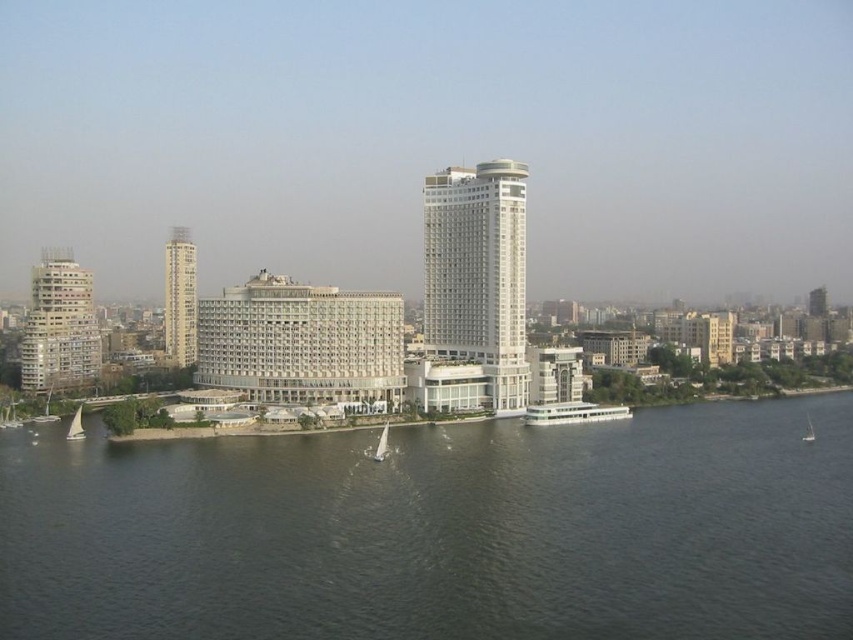
Does smooth beige tower at left have a greater height compared to white sailboat at lower center?

Indeed, smooth beige tower at left has a greater height compared to white sailboat at lower center.

Is point (189, 234) closer to viewer compared to point (381, 449)?

No.

Image resolution: width=853 pixels, height=640 pixels. What are the coordinates of `smooth beige tower at left` in the screenshot? It's located at (180, 298).

Does dark gray water at center appear over white glossy building at center?

Incorrect, dark gray water at center is not positioned above white glossy building at center.

Does dark gray water at center lie in front of white glossy building at center?

Yes, it is.

Find the location of a particular element. dark gray water at center is located at coordinates (440, 531).

At what (x,y) coordinates should I click in order to perform the action: click on dark gray water at center. Please return your answer as a coordinate pair (x, y). Looking at the image, I should click on (440, 531).

Is white glossy building at center bigger than white sailboat at lower right?

Yes.

Is white glossy building at center in front of white sailboat at lower right?

No, white glossy building at center is behind white sailboat at lower right.

This screenshot has width=853, height=640. I want to click on white glossy building at center, so click(x=479, y=275).